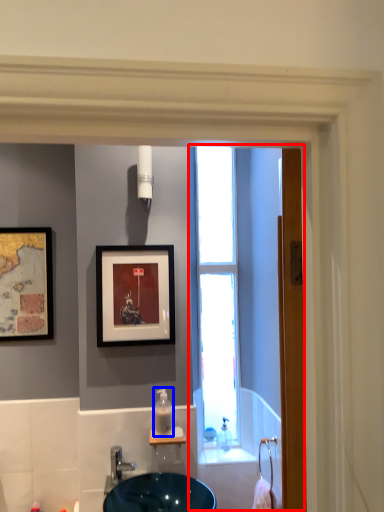
Question: Which point is closer to the camera, screen door (highlighted by a red box) or soap dispenser (highlighted by a blue box)?

Choices:
 (A) screen door
 (B) soap dispenser

Answer: (A)